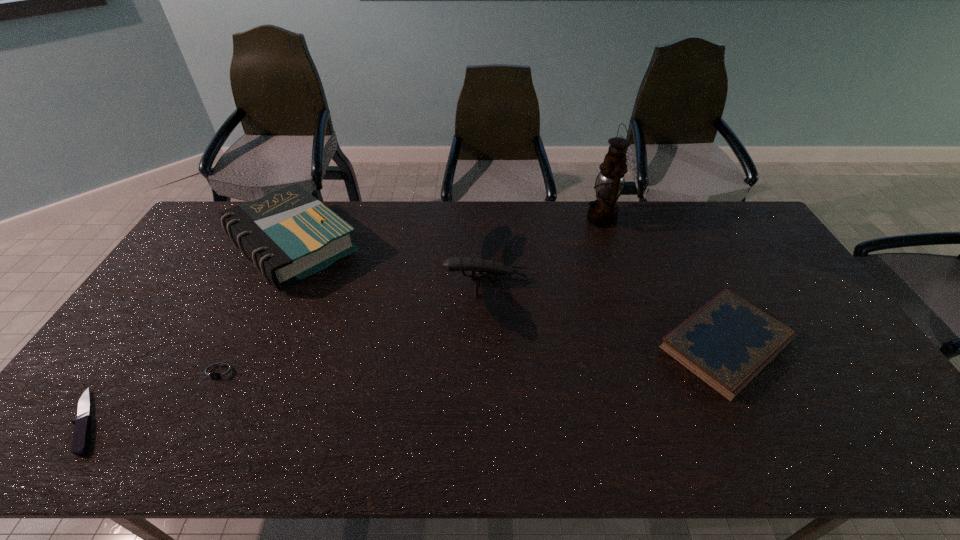
Locate an element on the screen. free location located 0.120m on the left of the oil lamp is located at coordinates (553, 219).

The width and height of the screenshot is (960, 540). Identify the location of free region located on the left of the left paperback book. (205, 247).

The width and height of the screenshot is (960, 540). I want to click on blank space located 0.080m at the head of the third object from right to left, so click(419, 280).

Identify the location of vacant region located 0.310m at the head of the third object from right to left. (346, 280).

Locate an element on the screen. vacant region located 0.140m at the head of the third object from right to left is located at coordinates (399, 280).

Identify the location of free space located 0.370m on the back of the shorter paperback book. The height and width of the screenshot is (540, 960). (665, 222).

The height and width of the screenshot is (540, 960). Find the location of `free point located on the face of the watch`. free point located on the face of the watch is located at coordinates (204, 409).

In order to click on free spot located on the right of the leftmost object in this screenshot , I will do `click(227, 421)`.

At what (x,y) coordinates should I click in order to perform the action: click on oil lamp at the far edge. Please return your answer as a coordinate pair (x, y). Image resolution: width=960 pixels, height=540 pixels. Looking at the image, I should click on (603, 212).

Find the location of `paperback book situated at the far edge`. paperback book situated at the far edge is located at coordinates (289, 234).